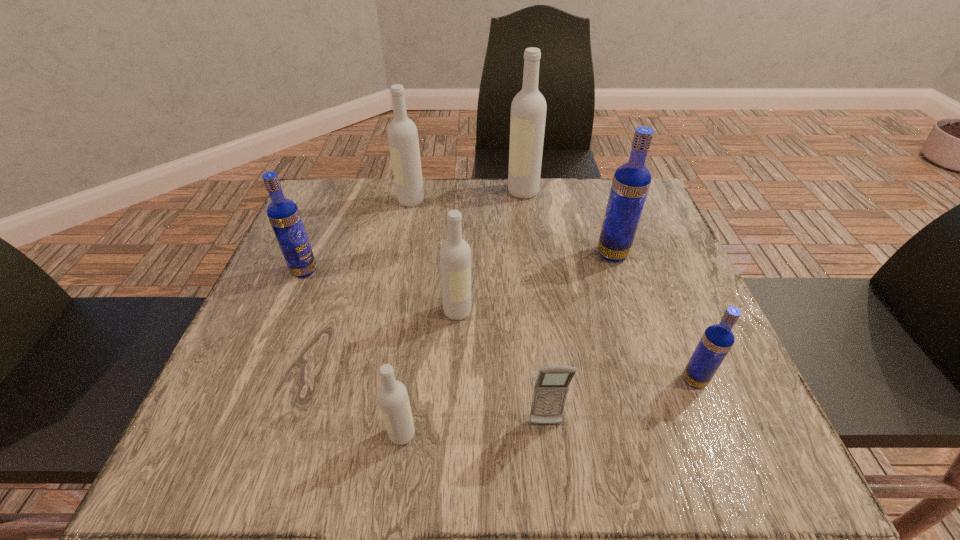
The height and width of the screenshot is (540, 960). In order to click on free spot between the tallest object and the leftmost vodka in this screenshot , I will do `click(414, 231)`.

I want to click on object that is the fifth closest one to the smallest white vodka, so click(631, 181).

Find the location of `object that can be found as the closest to the tallest vodka`. object that can be found as the closest to the tallest vodka is located at coordinates (631, 181).

Where is `vodka that is the fifth nearest to the sixth vodka from right to left`? vodka that is the fifth nearest to the sixth vodka from right to left is located at coordinates (392, 396).

Locate an element on the screen. The image size is (960, 540). vodka that stands as the fourth closest to the tallest vodka is located at coordinates (283, 214).

Point out which white vodka is positioned as the nearest to the second vodka from right to left. Please provide its 2D coordinates. Your answer should be formatted as a tuple, i.e. [(x, y)], where the tuple contains the x and y coordinates of a point satisfying the conditions above.

[(528, 109)]

Locate which white vodka ranks in proximity to the leftmost vodka. Please provide its 2D coordinates. Your answer should be formatted as a tuple, i.e. [(x, y)], where the tuple contains the x and y coordinates of a point satisfying the conditions above.

[(403, 140)]

The image size is (960, 540). In order to click on the closest blue vodka relative to the tallest object in this screenshot , I will do `click(631, 181)`.

Locate which blue vodka is the closest to the seventh object from right to left. Please provide its 2D coordinates. Your answer should be formatted as a tuple, i.e. [(x, y)], where the tuple contains the x and y coordinates of a point satisfying the conditions above.

[(283, 214)]

The width and height of the screenshot is (960, 540). I want to click on vacant space that satisfies the following two spatial constraints: 1. on the front side of the rightmost vodka; 2. on the right side of the seventh object from left to right, so click(654, 380).